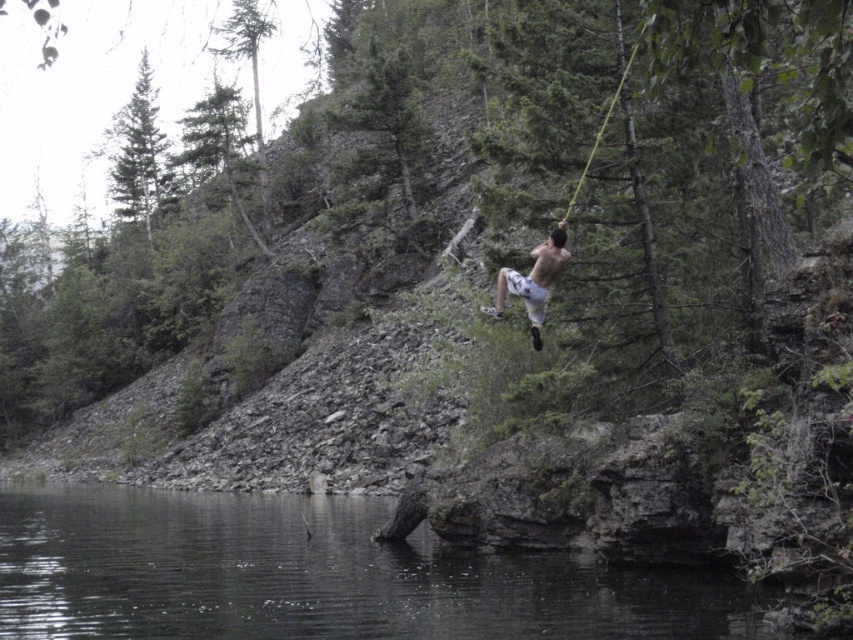
You are standing at the point labeled as point (312, 577) in the image. Looking around, you see transparent water at lower center. What is the direction of the transparent water relative to your position?

The transparent water at lower center is located directly below the point (312, 577), so it is in the downward direction from your current position.

You are a safety inspector evaluating this scene. You notice the white cotton shorts at center and the transparent water at lower center. Based on their positions, which object is located to the right?

The white cotton shorts at center is located to the right of the transparent water at lower center.

Based on the photo, you are standing at the edge of the scene and want to jump into the transparent water at lower center. However, you notice the white cotton shorts at center are in your way. Can you jump over them?

The transparent water at lower center is closer to the viewer than the white cotton shorts at center, so you can jump over the white cotton shorts at center to reach the transparent water at lower center.